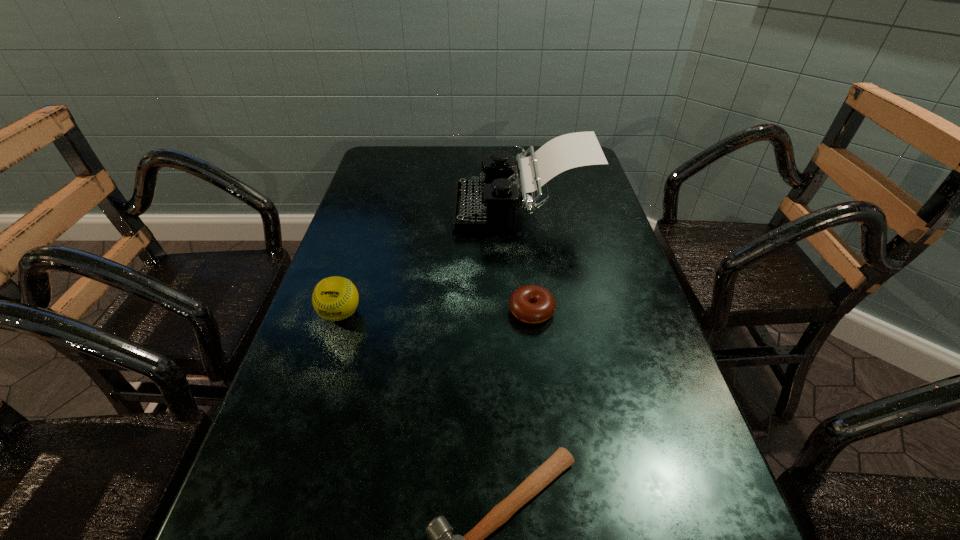
Find the location of a particular element. This screenshot has width=960, height=540. the farthest object is located at coordinates (479, 205).

Where is `typewriter`? The image size is (960, 540). typewriter is located at coordinates (479, 205).

The width and height of the screenshot is (960, 540). I want to click on softball, so click(x=335, y=298).

Locate an element on the screen. The image size is (960, 540). the leftmost object is located at coordinates (335, 298).

This screenshot has height=540, width=960. Identify the location of doughnut. (533, 304).

Identify the location of free location located 0.250m on the keys of the tallest object. The image size is (960, 540). (367, 208).

At what (x,y) coordinates should I click in order to perform the action: click on vacant space situated 0.300m on the keys of the tallest object. Please return your answer as a coordinate pair (x, y). The image size is (960, 540). Looking at the image, I should click on (349, 208).

Where is `vacant point located 0.270m on the keys of the tallest object`? This screenshot has height=540, width=960. vacant point located 0.270m on the keys of the tallest object is located at coordinates click(360, 208).

Locate an element on the screen. free space located 0.350m on the logo side of the third shortest object is located at coordinates (278, 506).

Where is `vacant area located on the left of the doughnut`? The height and width of the screenshot is (540, 960). vacant area located on the left of the doughnut is located at coordinates (326, 311).